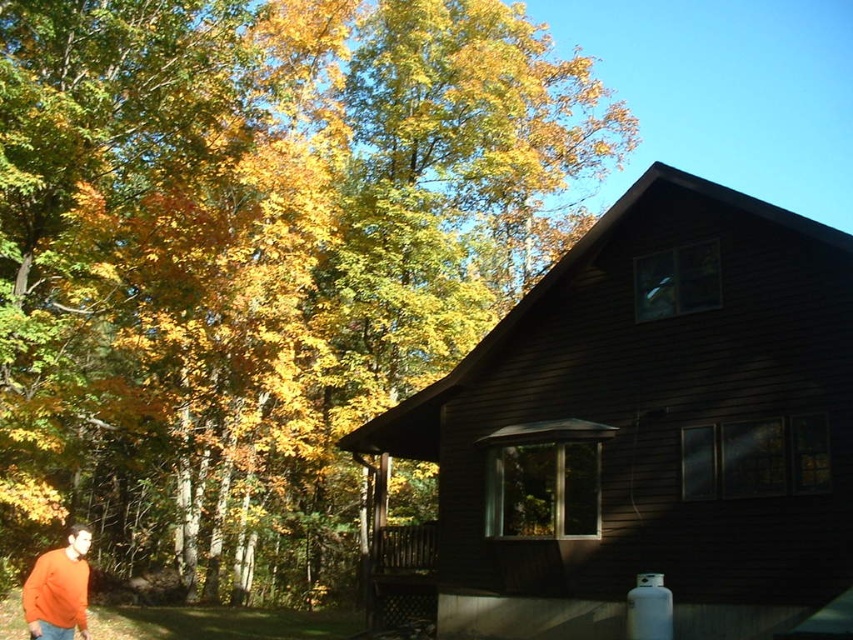
Question: In this image, where is golden yellow leaves at upper left located relative to dark wood cabin at center?

Choices:
 (A) left
 (B) right

Answer: (A)

Question: Among these objects, which one is nearest to the camera?

Choices:
 (A) dark wood cabin at center
 (B) orange sweater at lower left
 (C) golden yellow leaves at upper left

Answer: (A)

Question: Is golden yellow leaves at upper left thinner than dark wood cabin at center?

Choices:
 (A) yes
 (B) no

Answer: (B)

Question: Considering the real-world distances, which object is farthest from the dark wood cabin at center?

Choices:
 (A) orange sweater at lower left
 (B) golden yellow leaves at upper left

Answer: (B)

Question: Among these objects, which one is nearest to the camera?

Choices:
 (A) dark wood cabin at center
 (B) golden yellow leaves at upper left
 (C) orange sweater at lower left

Answer: (A)

Question: Does dark wood cabin at center appear under orange sweater at lower left?

Choices:
 (A) no
 (B) yes

Answer: (A)